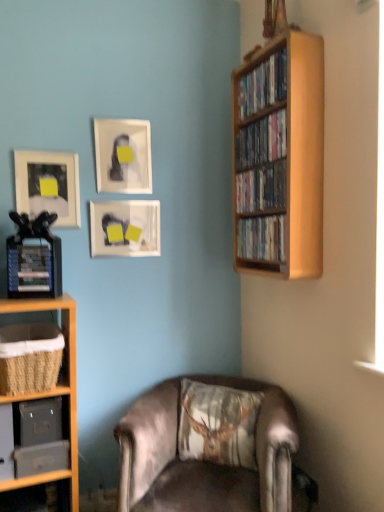
Question: Is wooden shelf at upper right, marked as the first book in a top-to-bottom arrangement, shorter than woven brown basket at lower left, which appears as the 1th shelf when viewed from the top?

Choices:
 (A) no
 (B) yes

Answer: (B)

Question: Is wooden shelf at upper right, which appears as the fourth book when ordered from the bottom, not within woven brown basket at lower left, placed as the second shelf when sorted from bottom to top?

Choices:
 (A) no
 (B) yes

Answer: (B)

Question: Is wooden shelf at upper right, which appears as the fourth book when ordered from the bottom, in contact with woven brown basket at lower left, placed as the second shelf when sorted from bottom to top?

Choices:
 (A) no
 (B) yes

Answer: (A)

Question: Can you confirm if wooden shelf at upper right, marked as the first book in a top-to-bottom arrangement, is bigger than woven brown basket at lower left, placed as the second shelf when sorted from bottom to top?

Choices:
 (A) yes
 (B) no

Answer: (B)

Question: Is wooden shelf at upper right, which appears as the fourth book when ordered from the bottom, closer to camera compared to woven brown basket at lower left, placed as the second shelf when sorted from bottom to top?

Choices:
 (A) yes
 (B) no

Answer: (B)

Question: From a real-world perspective, is wooden shelf at upper right, which appears as the fourth book when ordered from the bottom, under woven brown basket at lower left, which appears as the 1th shelf when viewed from the top?

Choices:
 (A) yes
 (B) no

Answer: (B)

Question: Considering the relative positions of hardcover book at left and wooden shelf at upper right, which is the 4th book in top-to-bottom order, in the image provided, is hardcover book at left behind wooden shelf at upper right, which is the 4th book in top-to-bottom order,?

Choices:
 (A) yes
 (B) no

Answer: (A)

Question: From the image's perspective, does hardcover book at left appear lower than wooden shelf at upper right, placed as the first book when sorted from bottom to top?

Choices:
 (A) yes
 (B) no

Answer: (A)

Question: Is hardcover book at left positioned in front of wooden shelf at upper right, which is the 4th book in top-to-bottom order?

Choices:
 (A) yes
 (B) no

Answer: (B)

Question: Is hardcover book at left turned away from wooden shelf at upper right, which is the 4th book in top-to-bottom order?

Choices:
 (A) no
 (B) yes

Answer: (A)

Question: Can you confirm if hardcover book at left is wider than wooden shelf at upper right, placed as the first book when sorted from bottom to top?

Choices:
 (A) no
 (B) yes

Answer: (A)

Question: Is hardcover book at left far from wooden shelf at upper right, placed as the first book when sorted from bottom to top?

Choices:
 (A) no
 (B) yes

Answer: (A)

Question: Is wooden shelf at lower left, the first shelf when ordered from bottom to top, aimed at wooden bookshelf at right?

Choices:
 (A) yes
 (B) no

Answer: (B)